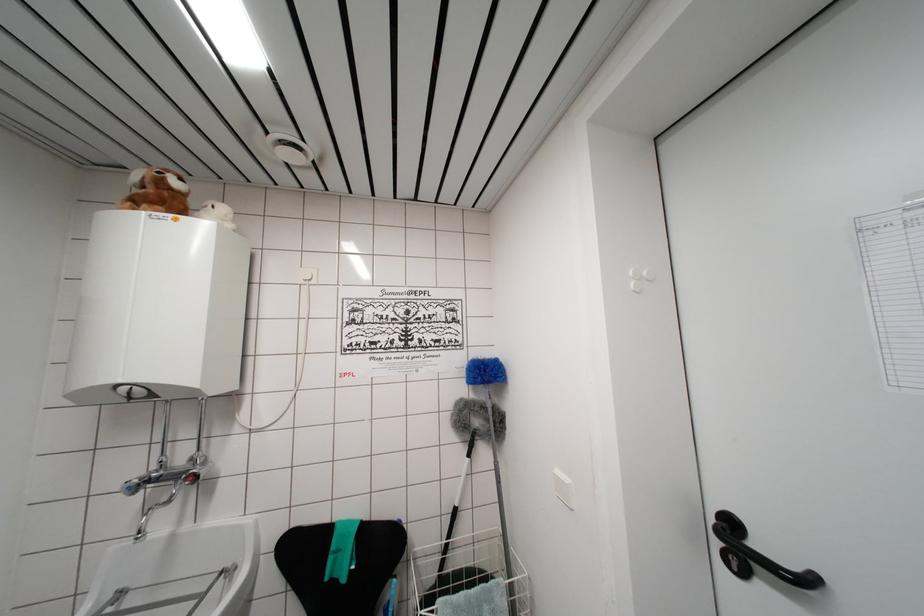
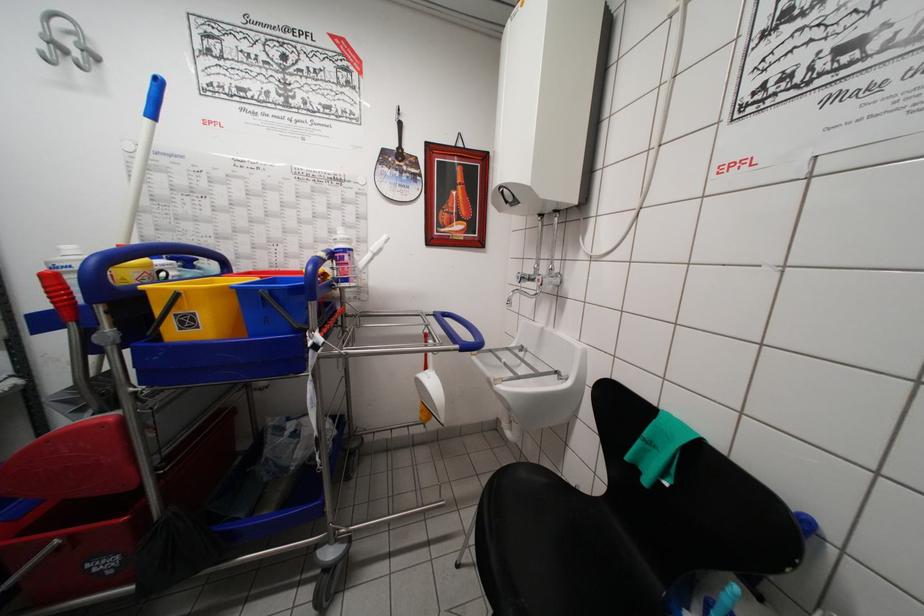
Question: How did the camera likely rotate?

Choices:
 (A) Left
 (B) Right
 (C) Up
 (D) Down

Answer: (A)